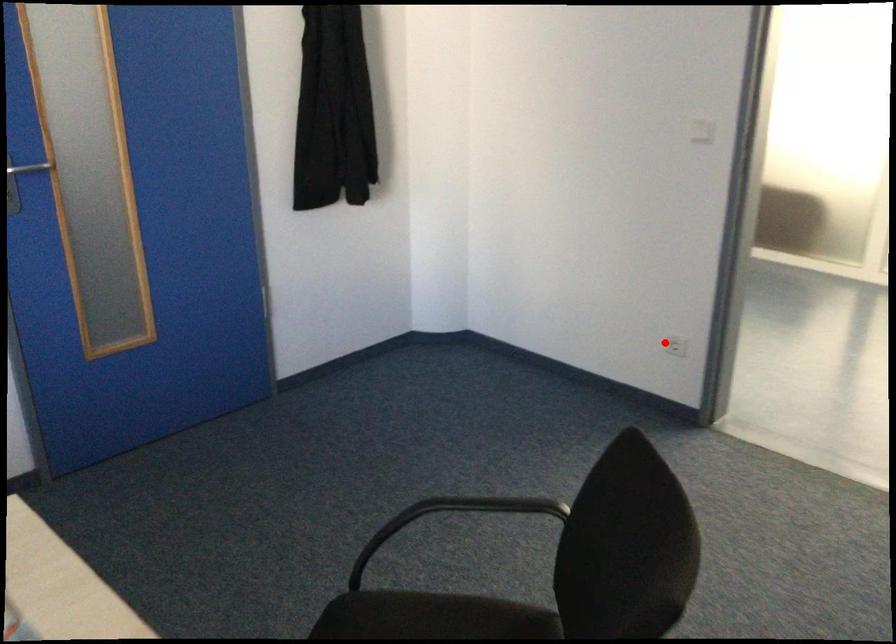
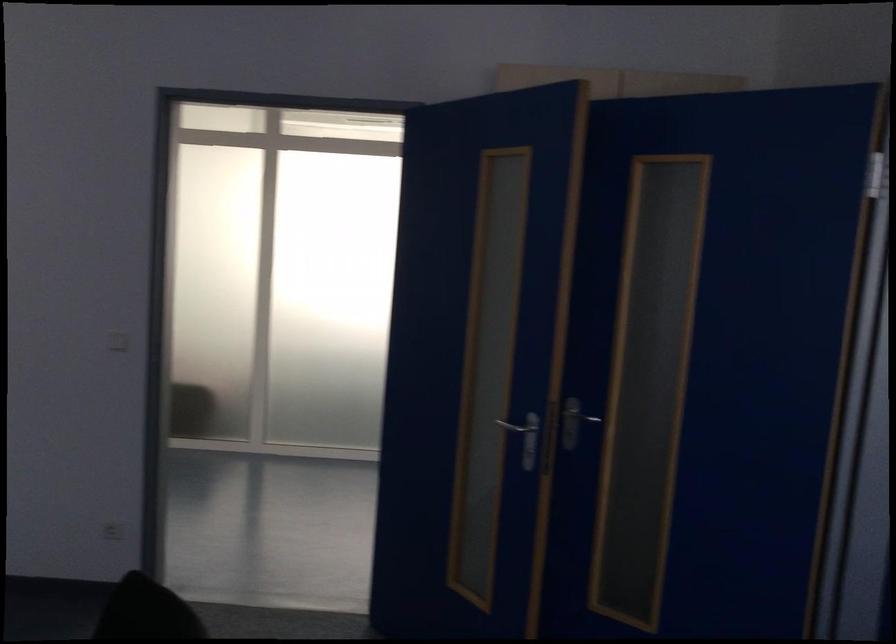
Question: A red point is marked in image1. In image2, is the corresponding 3D point closer to the camera or farther? Reply with the corresponding letter.

Choices:
 (A) The corresponding 3D point is closer.
 (B) The corresponding 3D point is farther.

Answer: (B)